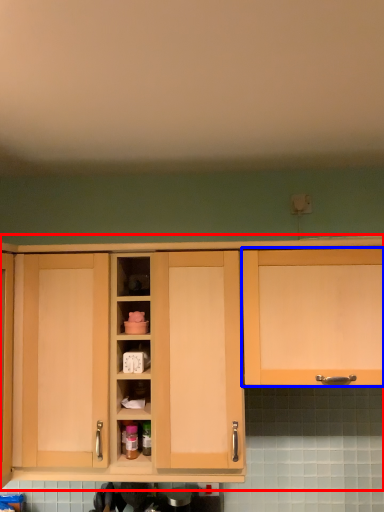
Question: Which object appears farthest to the camera in this image, cabinetry (highlighted by a red box) or cabinetry (highlighted by a blue box)?

Choices:
 (A) cabinetry
 (B) cabinetry

Answer: (A)